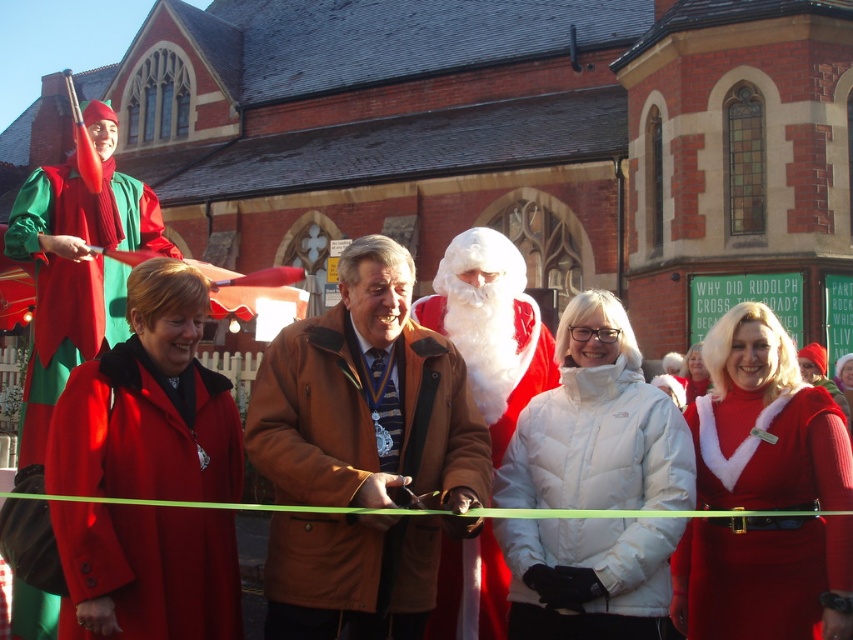
Question: Is brown leather jacket at center further to camera compared to white fluffy santa at center?

Choices:
 (A) no
 (B) yes

Answer: (A)

Question: Can you confirm if brown leather jacket at center is positioned to the left of white fluffy santa at center?

Choices:
 (A) yes
 (B) no

Answer: (A)

Question: Which of the following is the farthest from the observer?

Choices:
 (A) brown leather jacket at center
 (B) white fluffy santa at center

Answer: (B)

Question: Is brown leather jacket at center in front of white fluffy santa at center?

Choices:
 (A) yes
 (B) no

Answer: (A)